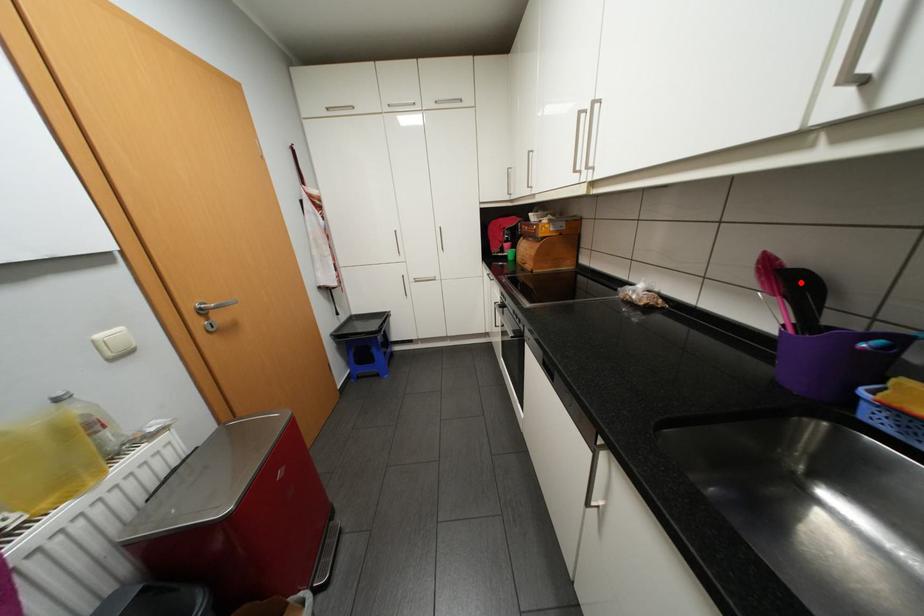
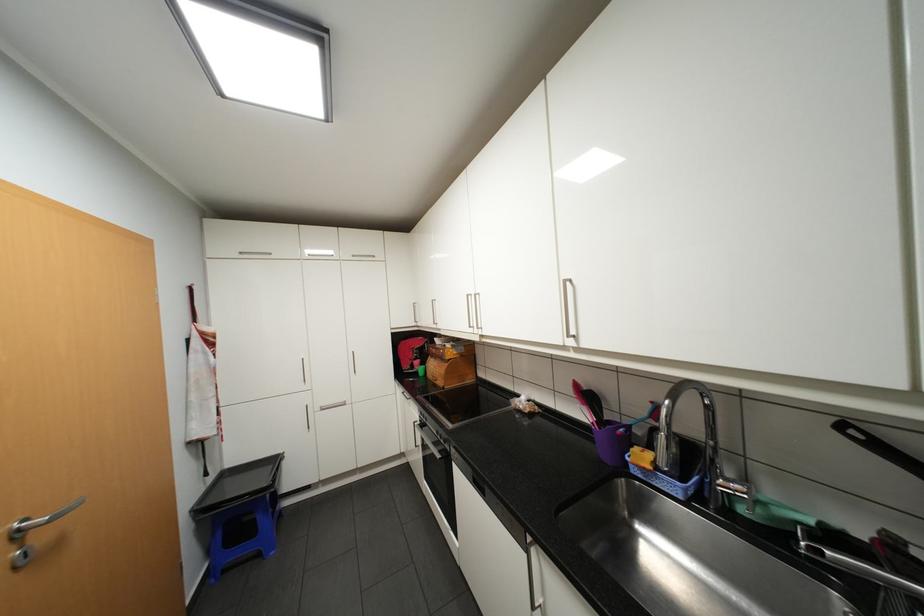
Locate, in the second image, the point that corresponds to the highlighted location in the first image.

(597, 397)